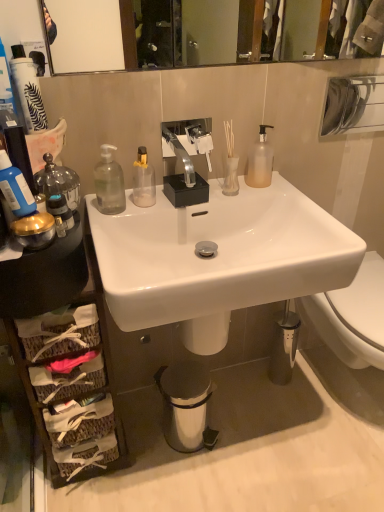
Locate an element on the screen. vacant space to the right of translucent glass vase at upper center is located at coordinates (278, 195).